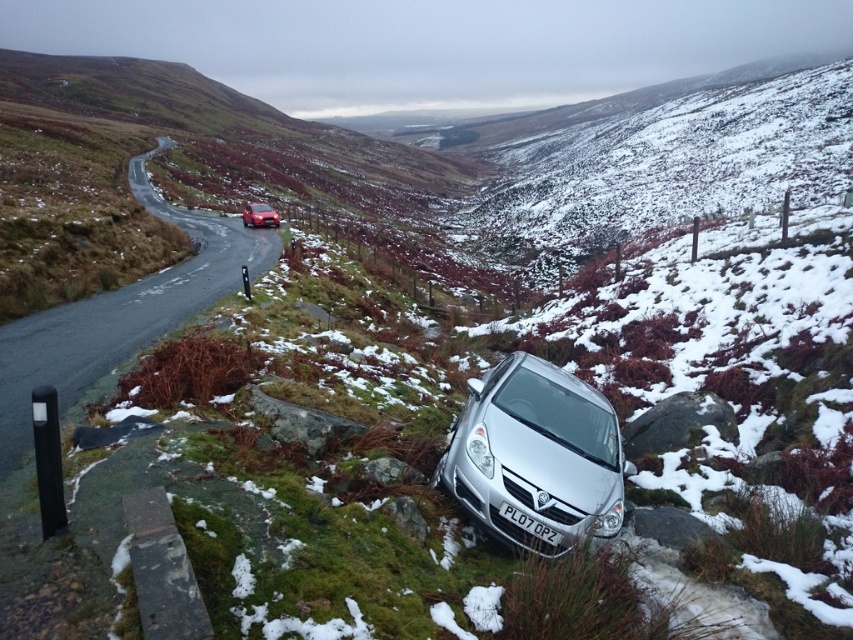
You are a driver in the silver car positioned on the edge of the road. You want to move forward to rejoin the road. There are two points marked on your GPS navigation system at coordinates point (599, 506) and point (515, 522). Which point should you head towards to safely rejoin the road?

You should head towards point (515, 522) because point (599, 506) is behind it, meaning point (515, 522) is closer to your current position and allows for a safer rejoining of the road.